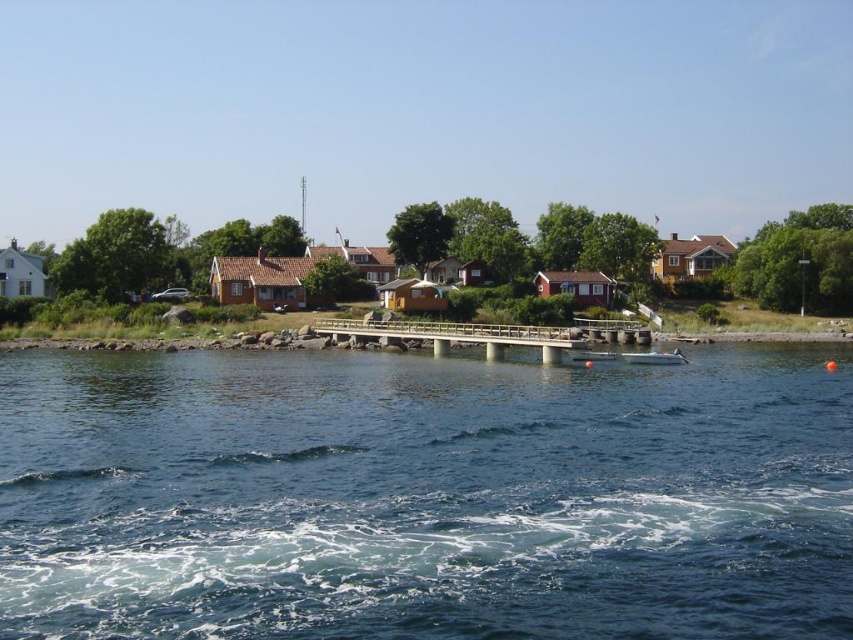
Can you confirm if blue water at lower center is taller than wooden bridge at center?

In fact, blue water at lower center may be shorter than wooden bridge at center.

Is blue water at lower center closer to the viewer compared to wooden bridge at center?

That is True.

This screenshot has height=640, width=853. I want to click on blue water at lower center, so click(x=422, y=497).

Describe the element at coordinates (422, 497) in the screenshot. I see `blue water at lower center` at that location.

Who is positioned more to the right, blue water at lower center or white glossy boat at center?

white glossy boat at center is more to the right.

Which is behind, point (463, 480) or point (643, 356)?

Positioned behind is point (643, 356).

At what (x,y) coordinates should I click in order to perform the action: click on blue water at lower center. Please return your answer as a coordinate pair (x, y). This screenshot has height=640, width=853. Looking at the image, I should click on (422, 497).

Which is behind, point (334, 324) or point (680, 355)?

The point (334, 324) is behind.

This screenshot has width=853, height=640. What do you see at coordinates (463, 336) in the screenshot?
I see `wooden bridge at center` at bounding box center [463, 336].

Where is `wooden bridge at center`? wooden bridge at center is located at coordinates (463, 336).